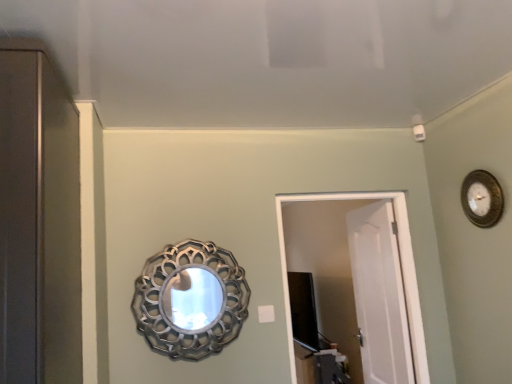
Question: Is white matte door at center, the 1th door from the front, not within white plastic light switch at center?

Choices:
 (A) no
 (B) yes

Answer: (B)

Question: Is the position of white matte door at center, the 1th door from the front, less distant than that of white plastic light switch at center?

Choices:
 (A) yes
 (B) no

Answer: (B)

Question: Does white matte door at center, the 1th door from the front, appear on the left side of white plastic light switch at center?

Choices:
 (A) yes
 (B) no

Answer: (B)

Question: Is white matte door at center, arranged as the 2th door when viewed from the back, positioned with its back to white plastic light switch at center?

Choices:
 (A) yes
 (B) no

Answer: (B)

Question: Is white matte door at center, the 1th door from the front, to the right of white plastic light switch at center from the viewer's perspective?

Choices:
 (A) no
 (B) yes

Answer: (B)

Question: Is white matte door at center, the 1th door from the front, directly adjacent to white plastic light switch at center?

Choices:
 (A) no
 (B) yes

Answer: (A)

Question: Is white matte door at center, the 1th door from the front, behind black glossy tv at center?

Choices:
 (A) yes
 (B) no

Answer: (B)

Question: Is white matte door at center, arranged as the 2th door when viewed from the back, to the right of black glossy tv at center from the viewer's perspective?

Choices:
 (A) yes
 (B) no

Answer: (A)

Question: Does white matte door at center, the 1th door from the front, have a lesser height compared to black glossy tv at center?

Choices:
 (A) yes
 (B) no

Answer: (B)

Question: Does white matte door at center, arranged as the 2th door when viewed from the back, come in front of black glossy tv at center?

Choices:
 (A) yes
 (B) no

Answer: (A)

Question: Is white matte door at center, arranged as the 2th door when viewed from the back, to the left of black glossy tv at center from the viewer's perspective?

Choices:
 (A) no
 (B) yes

Answer: (A)

Question: Does white matte door at center, arranged as the 2th door when viewed from the back, turn towards black glossy tv at center?

Choices:
 (A) no
 (B) yes

Answer: (A)

Question: Is metallic silver mirror at center smaller than white matte door at center, acting as the second door starting from the front?

Choices:
 (A) yes
 (B) no

Answer: (A)